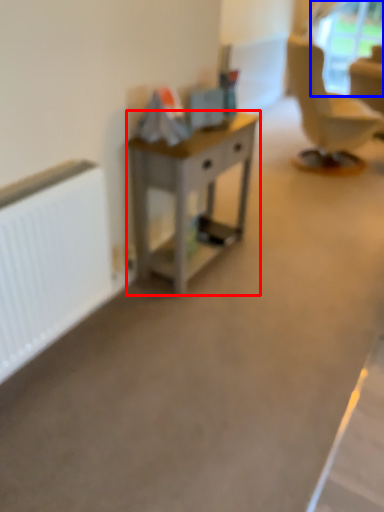
Question: Which object appears farthest to the camera in this image, desk (highlighted by a red box) or window screen (highlighted by a blue box)?

Choices:
 (A) desk
 (B) window screen

Answer: (B)